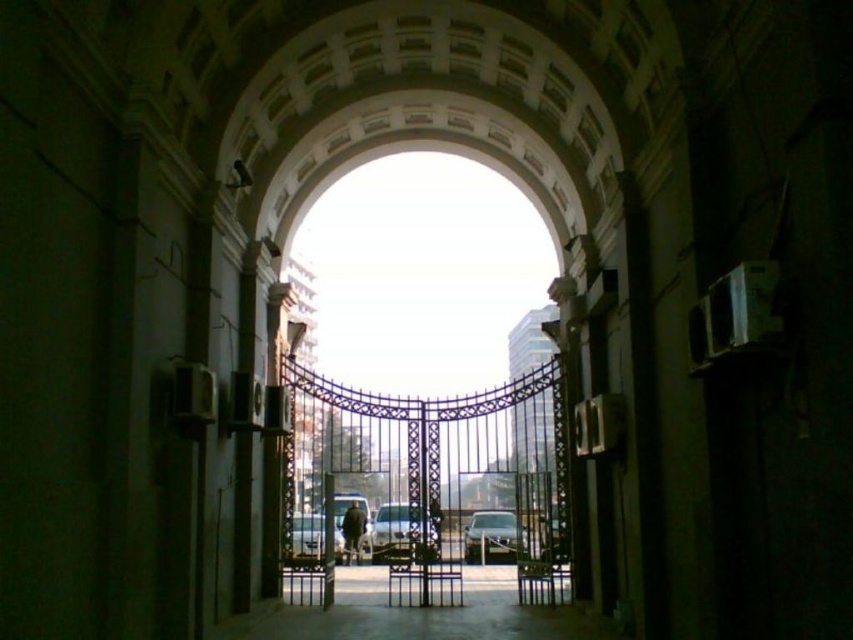
Question: Based on their relative distances, which object is nearer to the dark fabric jacket at center?

Choices:
 (A) silver metallic van at center
 (B) satin silver car at center
 (C) silver metallic car at center

Answer: (C)

Question: Which of these objects is positioned farthest from the silver metallic car at center?

Choices:
 (A) silver metallic van at center
 (B) satin silver car at center
 (C) dark fabric jacket at center

Answer: (B)

Question: Which of the following is the farthest from the observer?

Choices:
 (A) (469, 534)
 (B) (314, 556)
 (C) (351, 532)
 (D) (390, 536)

Answer: (A)

Question: Is satin silver car at center above dark fabric jacket at center?

Choices:
 (A) no
 (B) yes

Answer: (A)

Question: Is silver metallic car at center closer to the viewer compared to dark fabric jacket at center?

Choices:
 (A) yes
 (B) no

Answer: (A)

Question: Does satin silver car at center appear under silver metallic car at center?

Choices:
 (A) yes
 (B) no

Answer: (A)